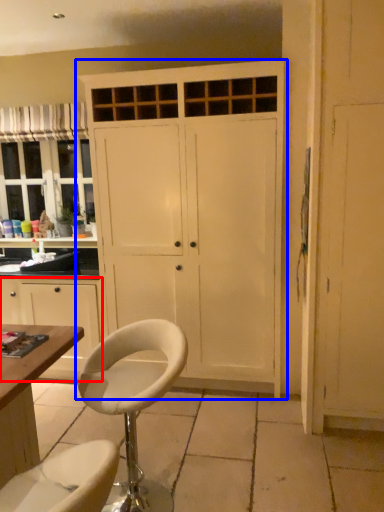
Question: Which of the following is the closest to the observer, cabinetry (highlighted by a red box) or cupboard (highlighted by a blue box)?

Choices:
 (A) cabinetry
 (B) cupboard

Answer: (B)